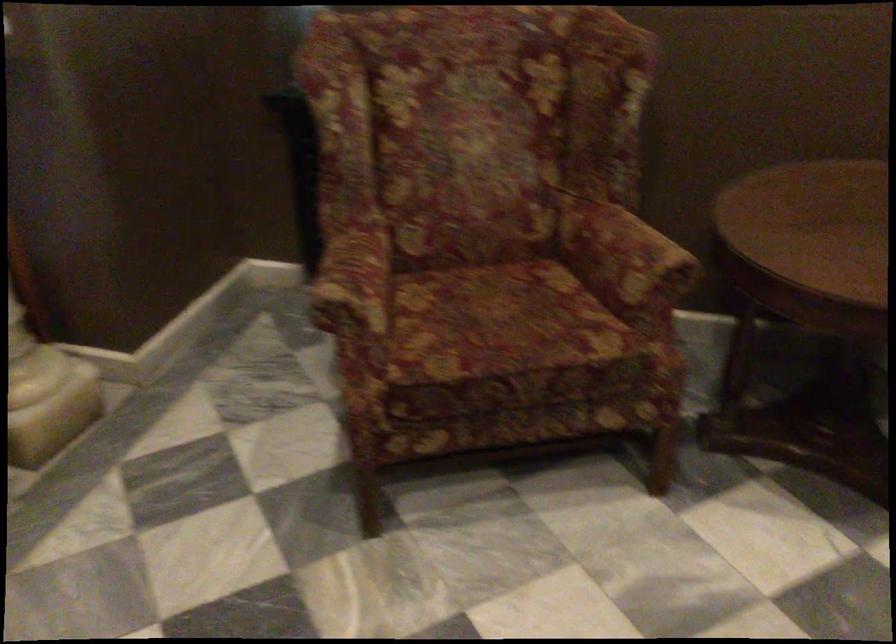
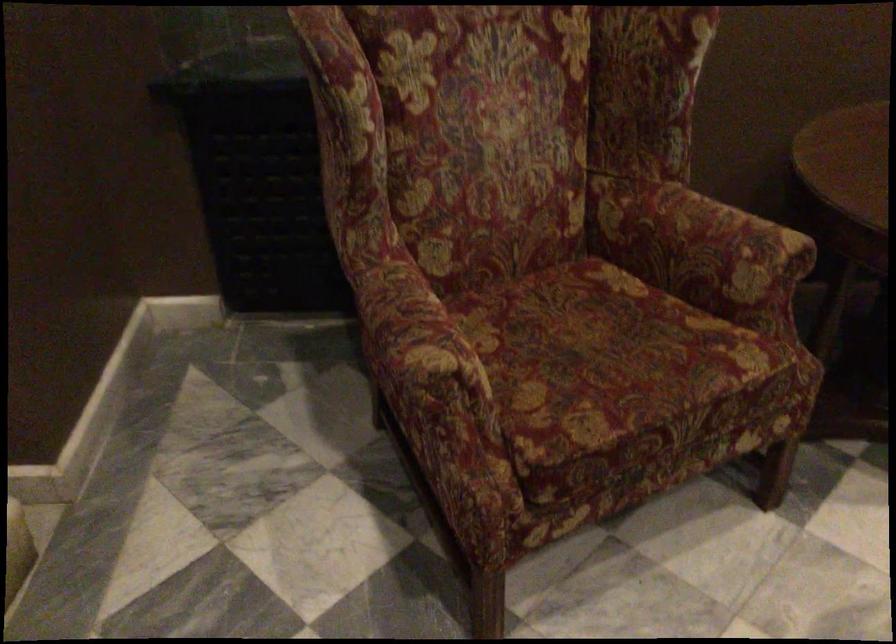
In the second image, find the point that corresponds to [496,327] in the first image.

(606, 361)